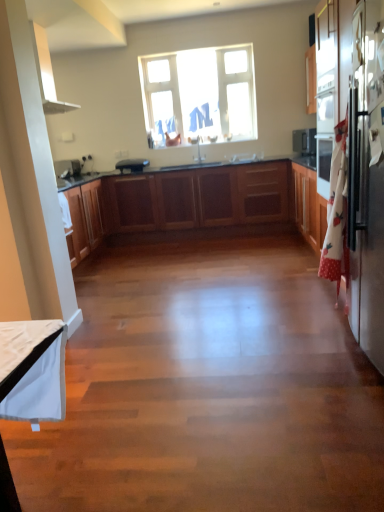
Question: Is white glossy sink at center beside black matte toaster at center?

Choices:
 (A) no
 (B) yes

Answer: (A)

Question: Is white glossy sink at center far from black matte toaster at center?

Choices:
 (A) yes
 (B) no

Answer: (A)

Question: Is white glossy sink at center not inside black matte toaster at center?

Choices:
 (A) no
 (B) yes

Answer: (B)

Question: Can you confirm if white glossy sink at center is bigger than black matte toaster at center?

Choices:
 (A) no
 (B) yes

Answer: (A)

Question: From the image's perspective, is white glossy sink at center on black matte toaster at center?

Choices:
 (A) yes
 (B) no

Answer: (A)

Question: Does white glossy sink at center have a smaller size compared to black matte toaster at center?

Choices:
 (A) no
 (B) yes

Answer: (B)

Question: Is clear glass window at upper center smaller than white glossy sink at center?

Choices:
 (A) yes
 (B) no

Answer: (B)

Question: Does clear glass window at upper center have a larger size compared to white glossy sink at center?

Choices:
 (A) no
 (B) yes

Answer: (B)

Question: Does clear glass window at upper center have a lesser height compared to white glossy sink at center?

Choices:
 (A) no
 (B) yes

Answer: (A)

Question: Would you say white glossy sink at center is part of clear glass window at upper center's contents?

Choices:
 (A) yes
 (B) no

Answer: (B)

Question: Could you tell me if clear glass window at upper center is turned towards white glossy sink at center?

Choices:
 (A) yes
 (B) no

Answer: (B)

Question: Can you confirm if clear glass window at upper center is positioned to the right of white glossy sink at center?

Choices:
 (A) yes
 (B) no

Answer: (B)

Question: Is clear glass window at upper center taller than sleek stainless steel refrigerator at right?

Choices:
 (A) no
 (B) yes

Answer: (A)